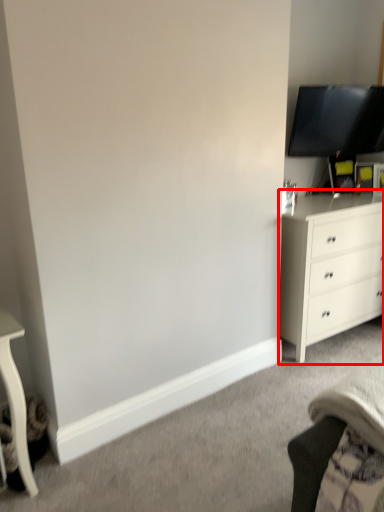
Question: From the image's perspective, considering the relative positions of chest of drawers (annotated by the red box) and television in the image provided, where is chest of drawers (annotated by the red box) located with respect to the staircase?

Choices:
 (A) above
 (B) below

Answer: (B)